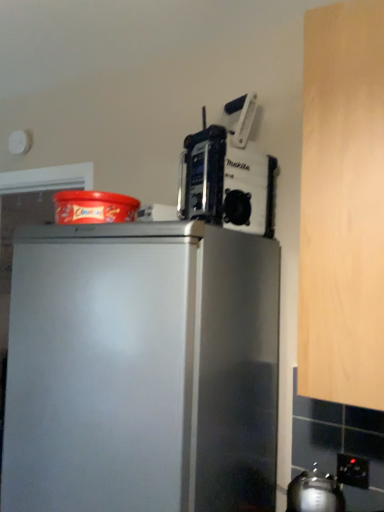
Question: Is point (182, 197) positioned closer to the camera than point (314, 495)?

Choices:
 (A) farther
 (B) closer

Answer: (A)

Question: Is metallic silver power tool at upper right wider or thinner than metallic silver kettle at lower right?

Choices:
 (A) thin
 (B) wide

Answer: (B)

Question: Which of these objects is positioned closest to the metallic silver power tool at upper right?

Choices:
 (A) metallic silver kettle at lower right
 (B) black plastic electric outlet at lower right

Answer: (A)

Question: Which of these objects is positioned farthest from the black plastic electric outlet at lower right?

Choices:
 (A) metallic silver kettle at lower right
 (B) metallic silver power tool at upper right

Answer: (B)